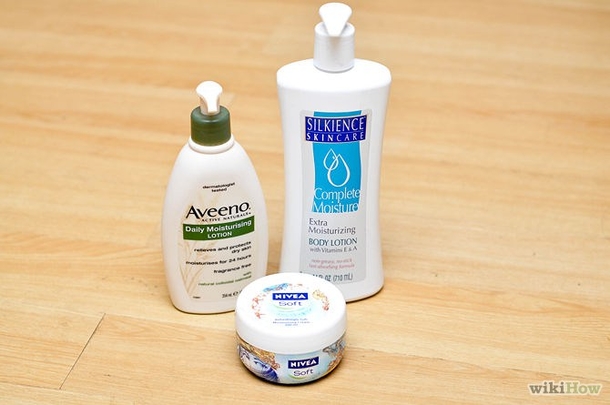
Locate an element on the screen. cracks in wood is located at coordinates (83, 349).